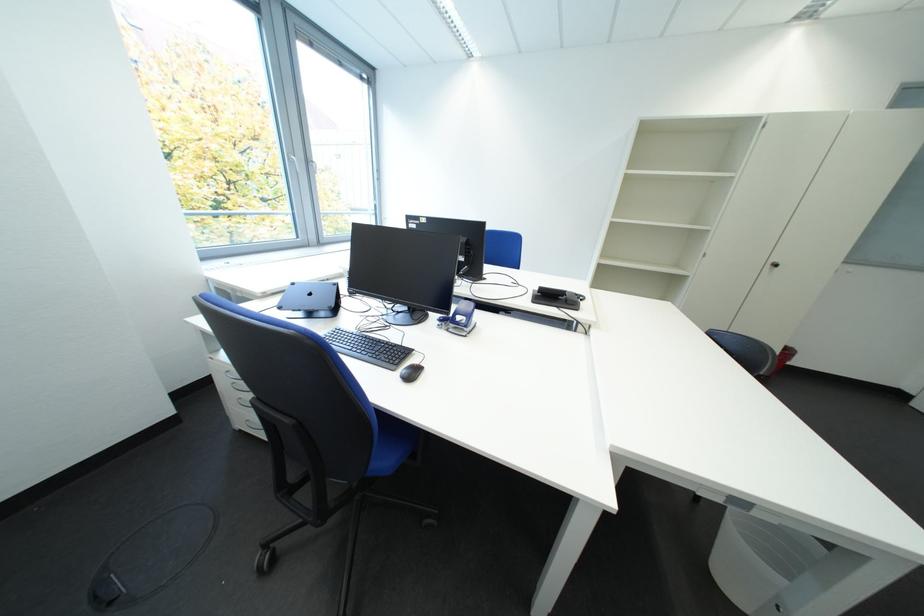
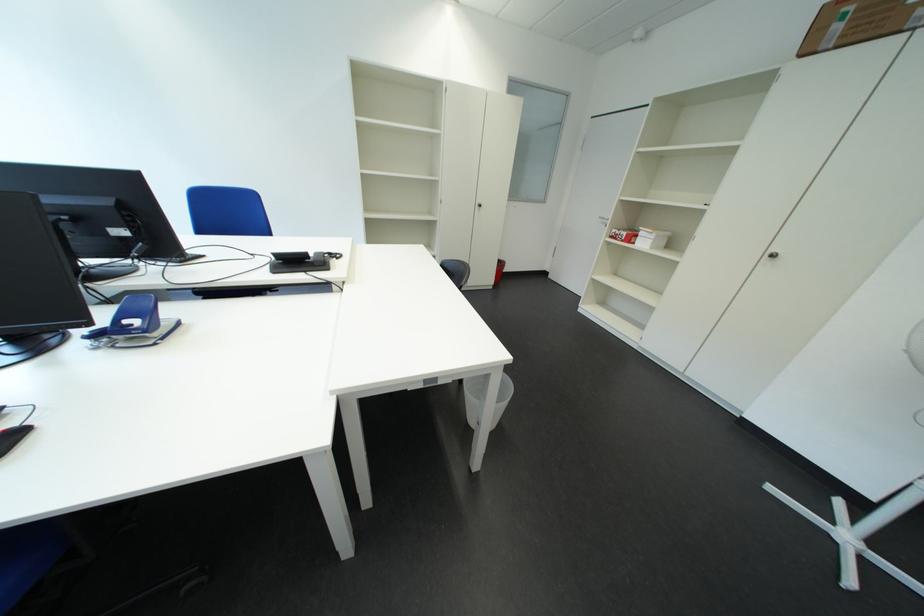
Question: I am providing you with two images of the same scene from different viewpoints. Which of the following objects are not visible in image2?

Choices:
 (A) red and white box
 (B) telephone handset
 (C) large cardboard box
 (D) none of these

Answer: (D)